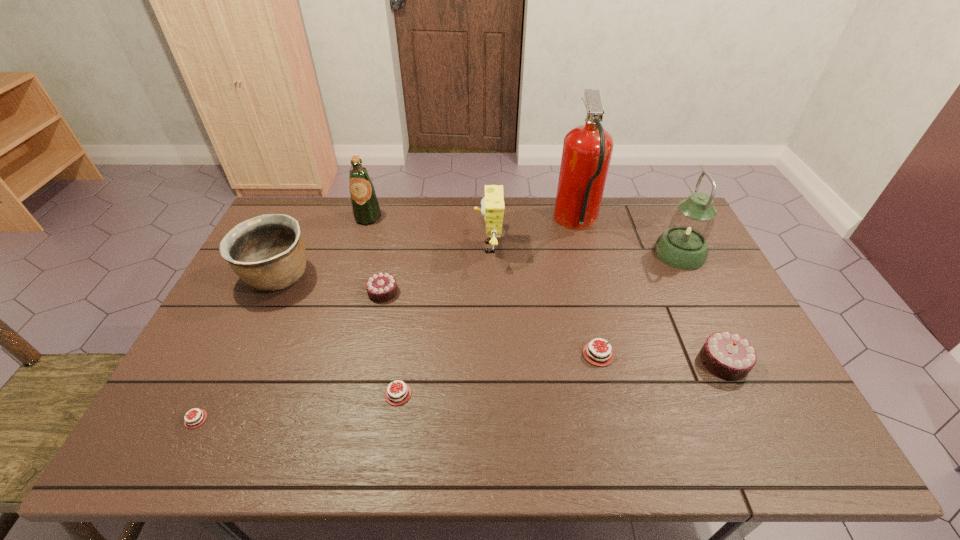
Identify the location of red fire extinguisher. This screenshot has width=960, height=540. (587, 149).

Where is `fire extinguisher`? The height and width of the screenshot is (540, 960). fire extinguisher is located at coordinates (587, 149).

Locate an element on the screen. This screenshot has width=960, height=540. greenish lantern is located at coordinates (683, 245).

I want to click on lantern, so click(683, 245).

Identify the location of olive oil. (365, 206).

This screenshot has width=960, height=540. I want to click on the eighth object from right to left, so click(365, 206).

This screenshot has height=540, width=960. What are the coordinates of `the seventh shortest object` in the screenshot? It's located at (492, 209).

This screenshot has width=960, height=540. In order to click on the fifth object from right to left in this screenshot , I will do `click(492, 209)`.

Identify the location of the sixth shortest object. This screenshot has width=960, height=540. (267, 252).

Find the location of a particular element. This screenshot has height=540, width=960. the tallest chocolate cake is located at coordinates (727, 355).